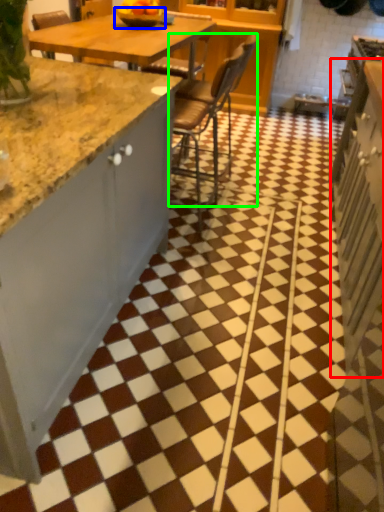
Question: Based on their relative distances, which object is farther from cabinetry (highlighted by a red box)? Choose from bowl (highlighted by a blue box) and chair (highlighted by a green box).

Choices:
 (A) bowl
 (B) chair

Answer: (A)